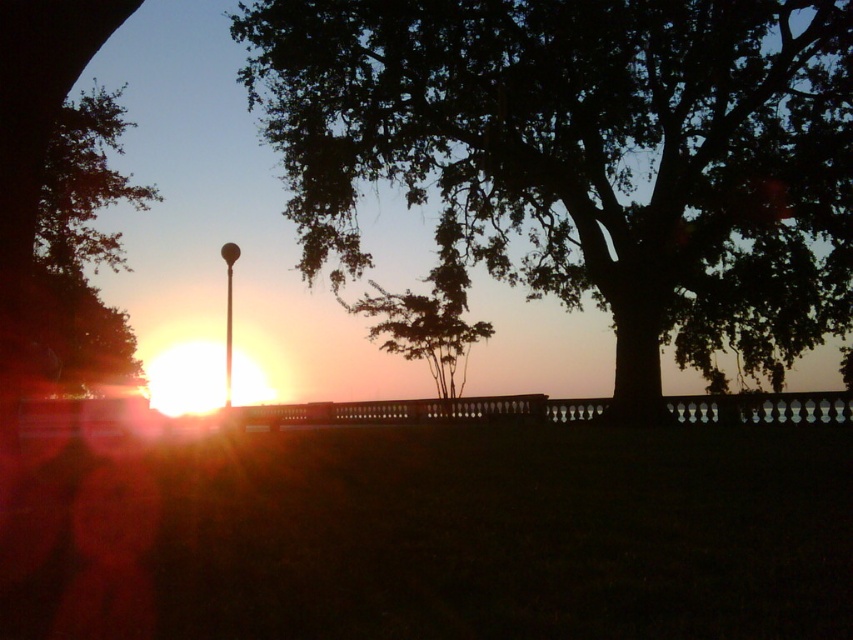
Question: Which point is farther to the camera?

Choices:
 (A) (630, 378)
 (B) (70, 241)
 (C) (231, 314)
 (D) (442, 316)

Answer: (D)

Question: Which point is farther from the camera taking this photo?

Choices:
 (A) (91, 369)
 (B) (227, 252)
 (C) (766, 77)
 (D) (399, 328)

Answer: (A)

Question: Does dark green leafy tree at center appear over green leafy tree at center?

Choices:
 (A) no
 (B) yes

Answer: (B)

Question: Which point appears closest to the camera in this image?

Choices:
 (A) (453, 282)
 (B) (756, 298)
 (C) (54, 326)
 (D) (228, 308)

Answer: (B)

Question: Can you confirm if green leafy tree at left is positioned below green leafy tree at center?

Choices:
 (A) no
 (B) yes

Answer: (A)

Question: Is green leafy tree at left further to camera compared to metallic pole at center?

Choices:
 (A) no
 (B) yes

Answer: (A)